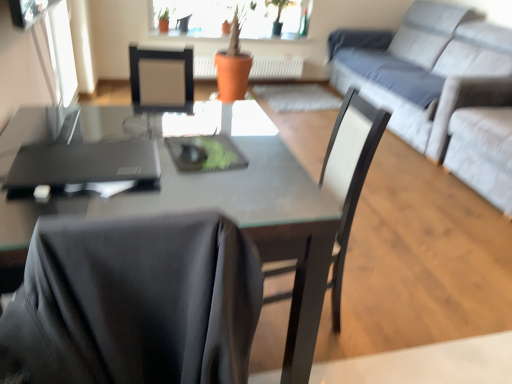
The width and height of the screenshot is (512, 384). Identify the location of vacant area to the right of black matte chair at center. (376, 316).